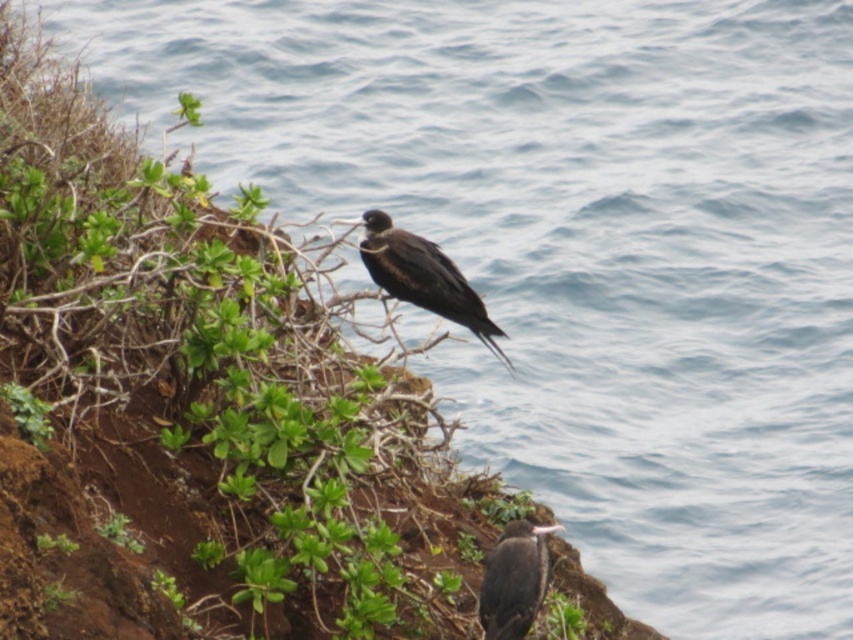
Question: Which object is closer to the camera taking this photo?

Choices:
 (A) shiny black bird at center
 (B) dark brown feathers at center

Answer: (B)

Question: Does shiny black bird at center come in front of dark brown feathers at center?

Choices:
 (A) no
 (B) yes

Answer: (A)

Question: Which object appears farthest from the camera in this image?

Choices:
 (A) dark brown feathers at center
 (B) shiny black bird at center

Answer: (B)

Question: Can you confirm if shiny black bird at center is smaller than dark brown feathers at center?

Choices:
 (A) no
 (B) yes

Answer: (A)

Question: Does shiny black bird at center come in front of dark brown feathers at center?

Choices:
 (A) yes
 (B) no

Answer: (B)